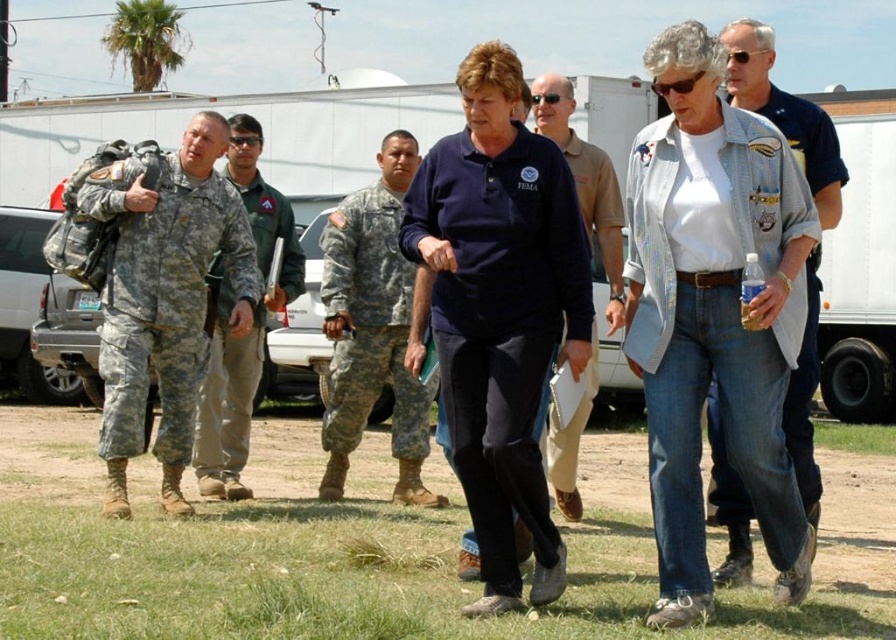
Is point (495, 404) positioned behind point (386, 157)?

No, it is not.

Based on the photo, who is more forward, (552,353) or (341,225)?

Point (552,353) is more forward.

The width and height of the screenshot is (896, 640). In order to click on navy blue cotton shirt at center in this screenshot , I will do `click(500, 316)`.

Between point (681, 308) and point (584, 196), which one is positioned in front?

Point (681, 308) is more forward.

Find the location of a particular element. This screenshot has height=640, width=896. denim jacket at center is located at coordinates (717, 332).

Which is behind, point (772, 195) or point (543, 88)?

The point (543, 88) is more distant.

Locate an element on the screen. The image size is (896, 640). denim jacket at center is located at coordinates (717, 332).

Where is `denim jacket at right`? This screenshot has width=896, height=640. denim jacket at right is located at coordinates (785, 113).

Is denim jacket at right smaller than blue cotton shirt at center?

Yes.

What do you see at coordinates (785, 113) in the screenshot? This screenshot has height=640, width=896. I see `denim jacket at right` at bounding box center [785, 113].

You are a GUI agent. You are given a task and a screenshot of the screen. Output one action in this format:
    pyautogui.click(x=<x>, y=<y>)
    Task: Click on the denim jacket at right
    This screenshot has height=640, width=896.
    Given the screenshot: What is the action you would take?
    pyautogui.click(x=785, y=113)